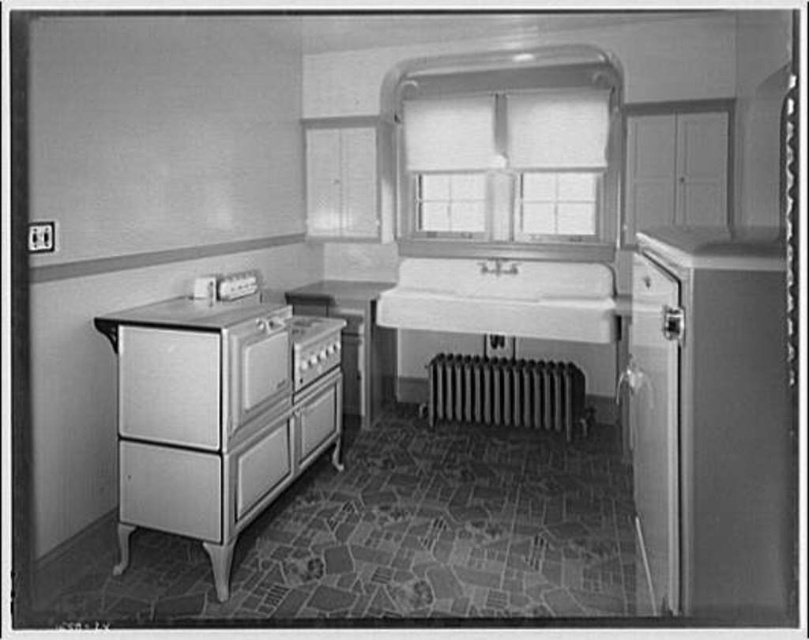
You are standing in the vintage kitchen and need to wash your hands. Where should you go relative to the white porcelain sink at center?

The white porcelain sink at center is located at the center of the kitchen, so you should go to the center to wash your hands.

You are a chef standing in the vintage kitchen and need to reach both the white textured window at center and the metallic silver drawer at lower left. Which object is closer to you?

The metallic silver drawer at lower left is closer to you because it is only 5.44 feet away from the white textured window at center, so the drawer is nearer than the window.